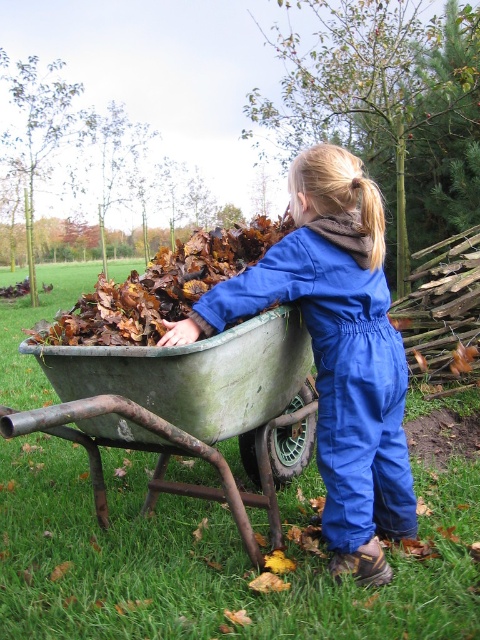
Question: Which is farther from the rusty metal wheelbarrow at center?

Choices:
 (A) blue cotton jumpsuit at center
 (B) brown fuzzy hair at upper center

Answer: (B)

Question: Is blue cotton jumpsuit at center to the left of rusty metal wheelbarrow at center from the viewer's perspective?

Choices:
 (A) yes
 (B) no

Answer: (B)

Question: Is blue cotton jumpsuit at center bigger than rusty metal wheelbarrow at center?

Choices:
 (A) yes
 (B) no

Answer: (B)

Question: Is blue cotton jumpsuit at center positioned before rusty metal wheelbarrow at center?

Choices:
 (A) no
 (B) yes

Answer: (A)

Question: Which point appears closest to the camera in this image?

Choices:
 (A) (376, 248)
 (B) (382, 525)

Answer: (A)

Question: Which object appears closest to the camera in this image?

Choices:
 (A) rusty metal wheelbarrow at center
 (B) brown fuzzy hair at upper center

Answer: (A)